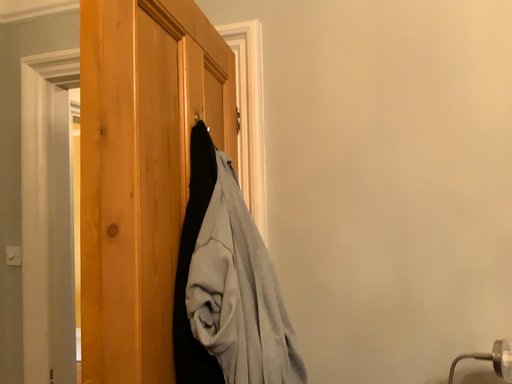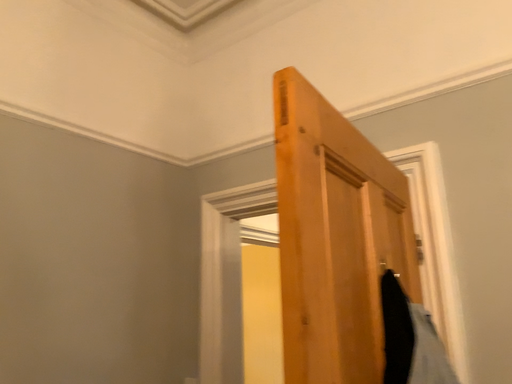
Question: Which way did the camera rotate in the video?

Choices:
 (A) rotated upward
 (B) rotated downward

Answer: (A)